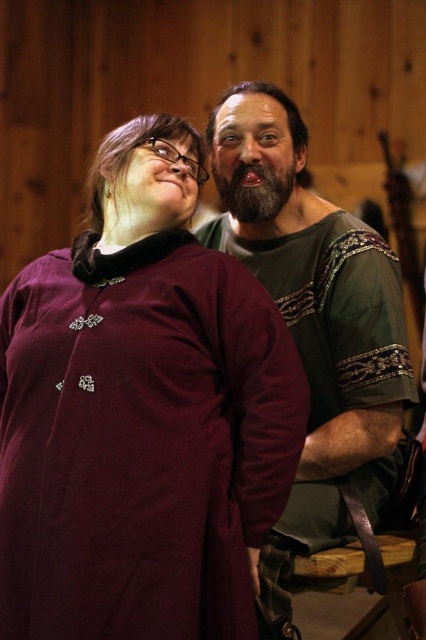
Identify the location of maroon fabric dress at center. (141, 413).

Measure the distance between maroon fabric dress at center and camera.

maroon fabric dress at center is 3.52 feet from camera.

The image size is (426, 640). I want to click on maroon fabric dress at center, so click(141, 413).